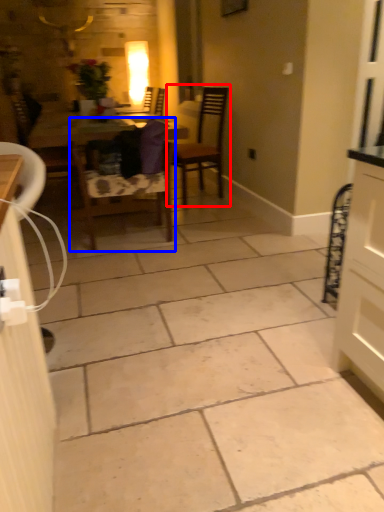
Question: Which of the following is the closest to the observer, chair (highlighted by a red box) or chair (highlighted by a blue box)?

Choices:
 (A) chair
 (B) chair

Answer: (B)